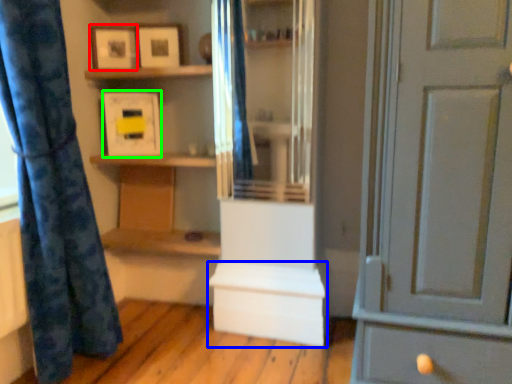
Question: Considering the real-world distances, which object is closest to picture frame (highlighted by a red box)? cabinetry (highlighted by a blue box) or picture frame (highlighted by a green box).

Choices:
 (A) cabinetry
 (B) picture frame

Answer: (B)